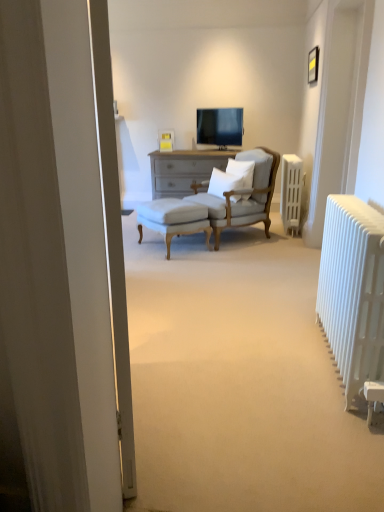
At what (x,y) coordinates should I click in order to perform the action: click on free space to the left of white metallic radiator at right, placed as the 1th radiator when sorted from left to right. Please return your answer as a coordinate pair (x, y). The image size is (384, 512). Looking at the image, I should click on (196, 339).